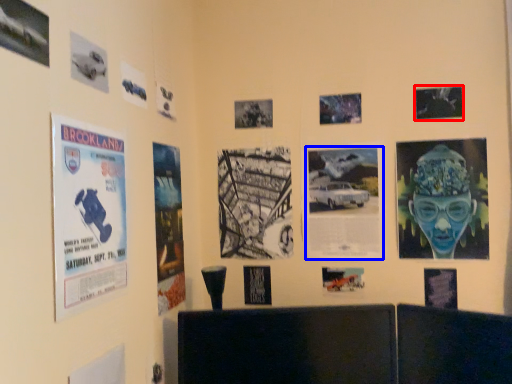
Question: Which object is closer to the camera taking this photo, poster (highlighted by a red box) or poster (highlighted by a blue box)?

Choices:
 (A) poster
 (B) poster

Answer: (A)